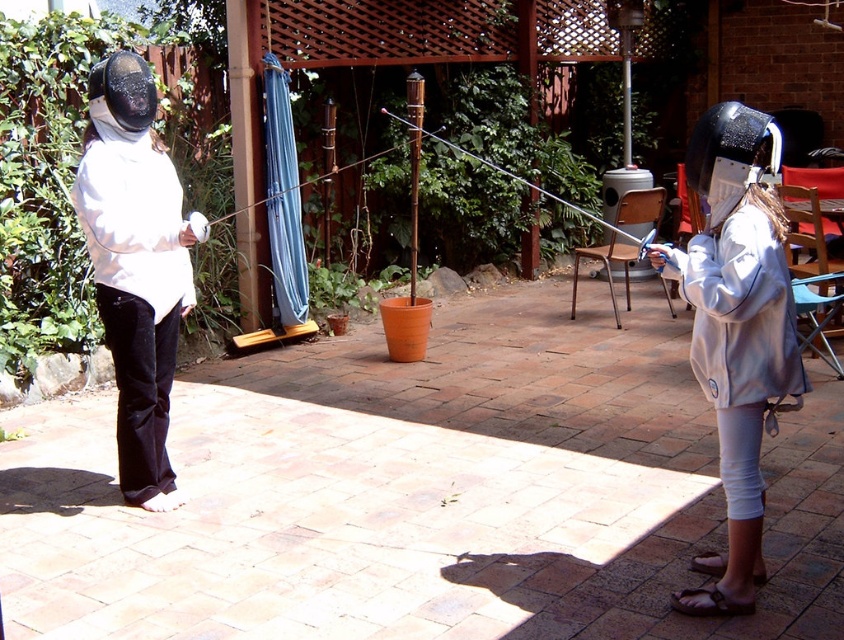
You are a referee at a fencing tournament. You need to ensure that the fencers maintain a safe distance of at least 2 meters apart during the match. Based on the scene, can you confirm if the white matte fencing suit at right and the white matte jacket at left are within the required distance?

The distance between the white matte fencing suit at right and the white matte jacket at left is 2.67 meters, which exceeds the minimum required distance of 2 meters. Therefore, they are within the safe distance requirement.

You are a photographer positioned at the center of the patio. You want to capture a closeup shot of both the white matte jacket at left and the light gray fleece jacket at right in the same frame. Given that your camera has a maximum focus range of 8 feet, will you be able to achieve this?

The white matte jacket at left is 8.75 feet away from the light gray fleece jacket at right. Since the distance between them exceeds the camera maximum focus range of 8 feet, you won